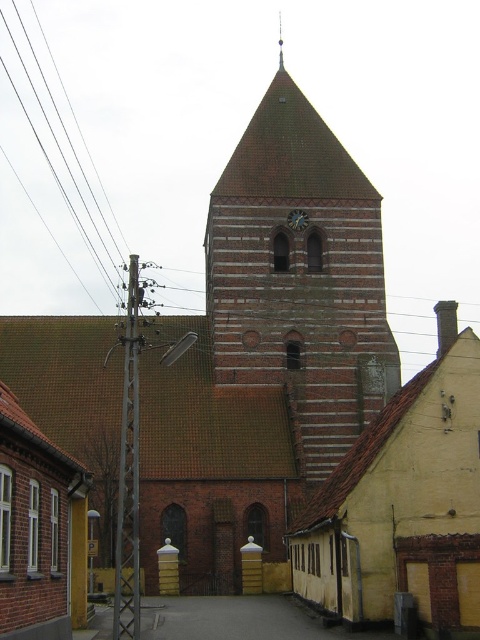
Question: Is brown brick tower at center positioned in front of matte brown clock at center?

Choices:
 (A) no
 (B) yes

Answer: (B)

Question: Which point is closer to the camera taking this photo?

Choices:
 (A) (119, 499)
 (B) (295, 353)
 (C) (288, 216)

Answer: (A)

Question: Which of these objects is positioned farthest from the metallic gray pole at left?

Choices:
 (A) matte brown clock at center
 (B) brown brick tower at center

Answer: (A)

Question: Can you confirm if brown brick tower at center is smaller than matte brown clock at center?

Choices:
 (A) yes
 (B) no

Answer: (B)

Question: Does metallic gray pole at left have a smaller size compared to matte brown clock at center?

Choices:
 (A) yes
 (B) no

Answer: (B)

Question: Which object appears farthest from the camera in this image?

Choices:
 (A) brown brick tower at center
 (B) metallic gray pole at left
 (C) matte brown clock at center

Answer: (C)